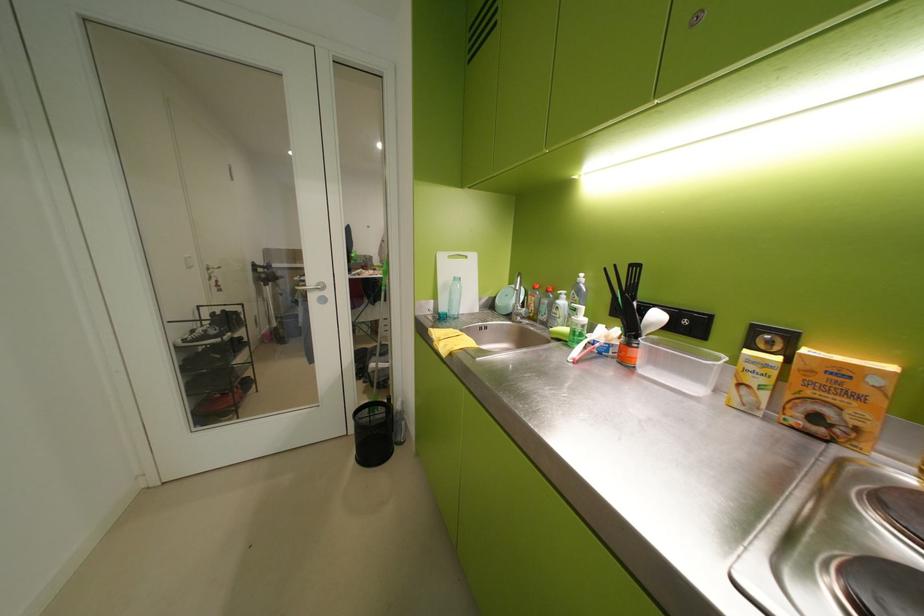
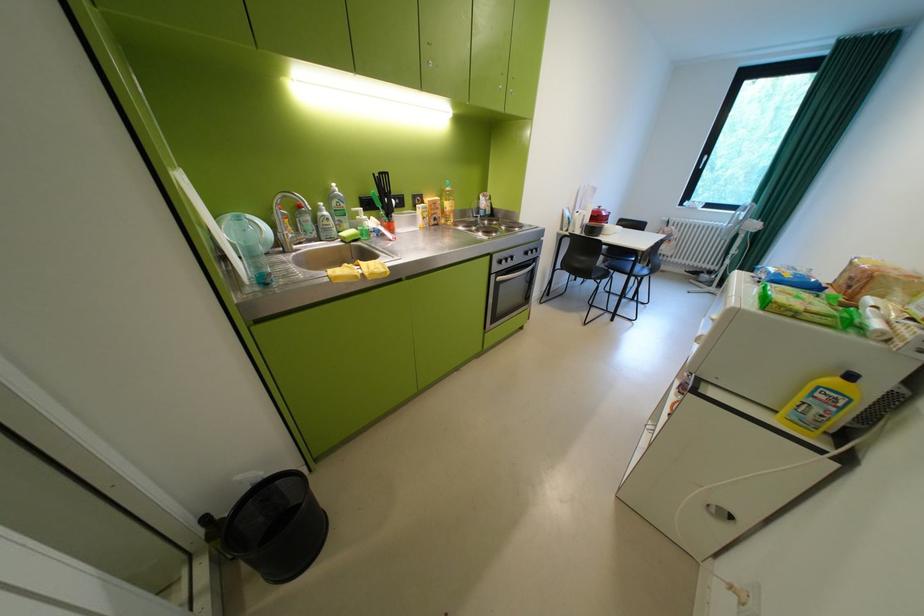
Question: I am providing you with two images of the same scene from different viewpoints. Please identify which objects are invisible in image2.

Choices:
 (A) metal lid handle
 (B) green soap bottle
 (C) oven control knob
 (D) white ladle

Answer: (D)